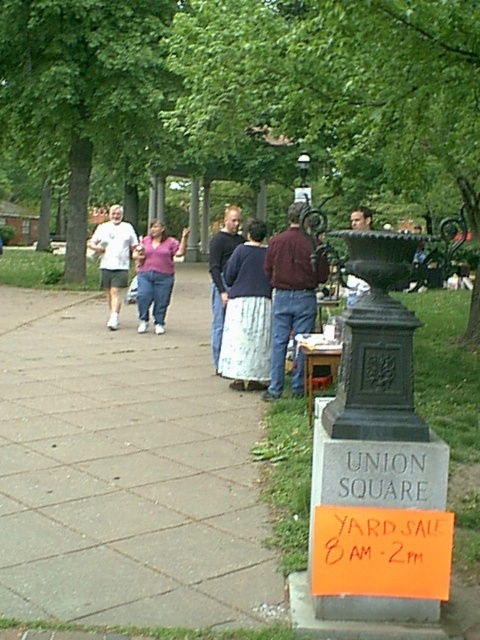
Question: From the image, what is the correct spatial relationship of maroon sweater at center in relation to matte white t-shirt at left?

Choices:
 (A) above
 (B) below

Answer: (B)

Question: From the image, what is the correct spatial relationship of green leafy tree at upper left in relation to smooth black statue at center?

Choices:
 (A) left
 (B) right

Answer: (A)

Question: Which point is farther from the camera taking this photo?

Choices:
 (A) (216, 284)
 (B) (105, 272)

Answer: (B)

Question: Which object is farther from the camera taking this photo?

Choices:
 (A) orange paper sign at lower right
 (B) gray concrete sidewalk at center

Answer: (B)

Question: Which object is farther from the camera taking this photo?

Choices:
 (A) orange paper sign at lower right
 (B) smooth black statue at center
 (C) light blue cotton skirt at center

Answer: (C)

Question: Can you confirm if maroon sweater at center is positioned above smooth black statue at center?

Choices:
 (A) no
 (B) yes

Answer: (A)